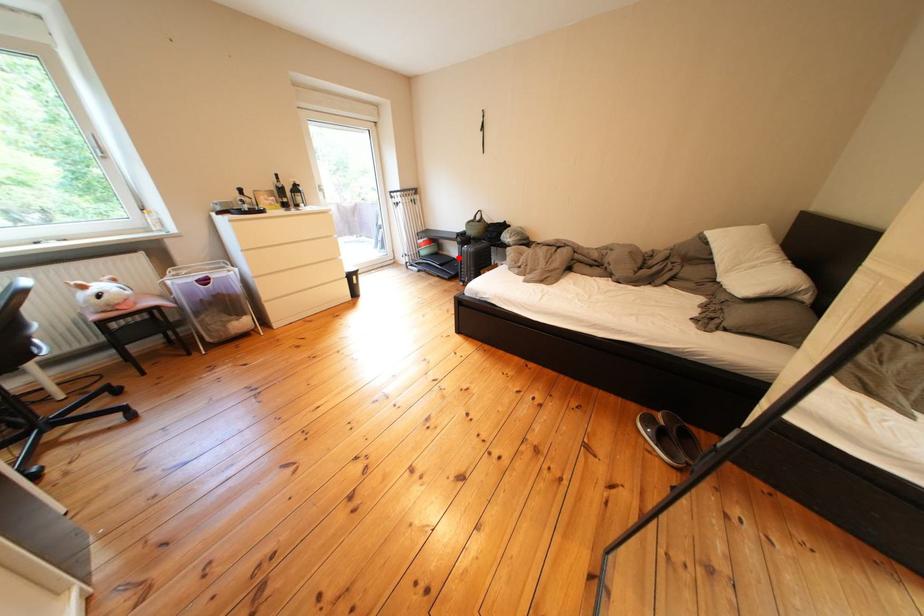
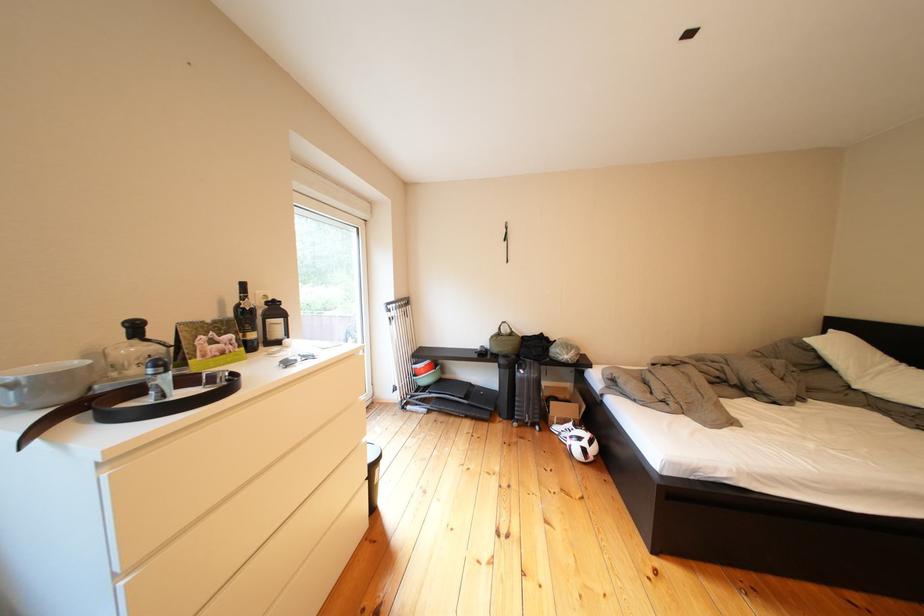
In the second image, find the point that corresponds to the highlighted location in the first image.

(462, 381)